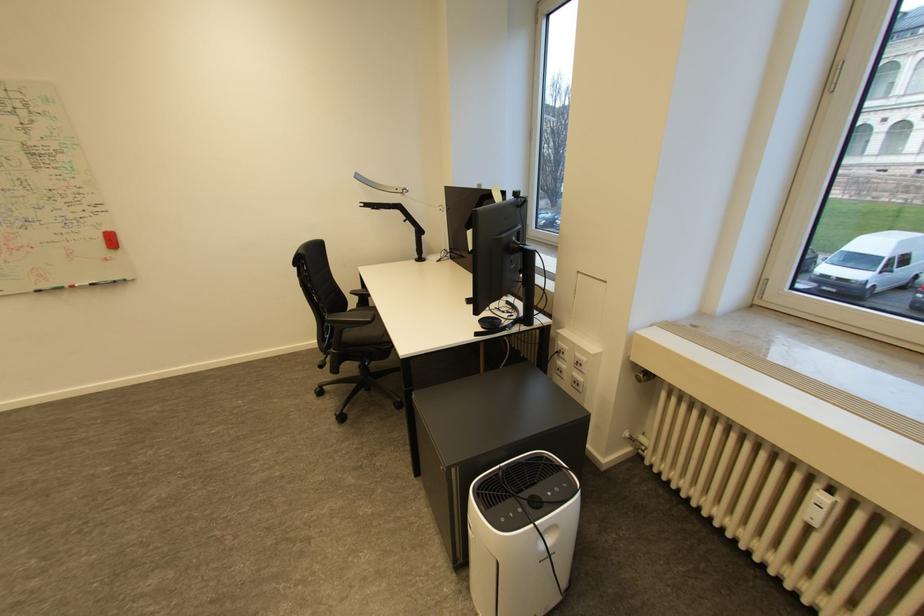
Where would you adjust the adjustable lamp arm? Please return your answer as a coordinate pair (x, y).

(402, 223)